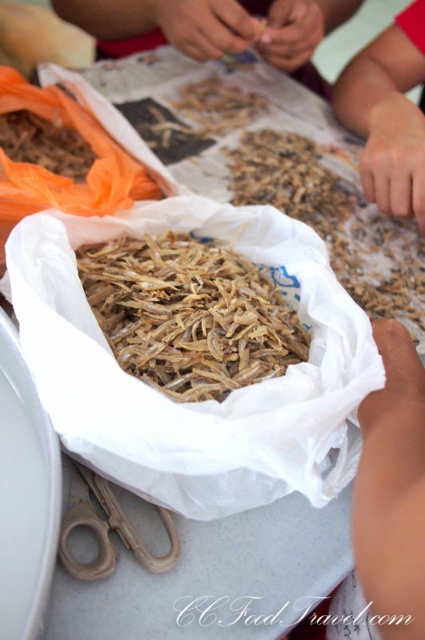
Question: Which is farther from the skinny arm at upper center?

Choices:
 (A) brown matte dried shrimp at center
 (B) brown crispy snack at center

Answer: (B)

Question: Can you confirm if brown matte dried shrimp at center is thinner than brown paper bag at upper center?

Choices:
 (A) no
 (B) yes

Answer: (B)

Question: Can you confirm if brown crispy snack at center is wider than brown wooden scissors at lower left?

Choices:
 (A) no
 (B) yes

Answer: (B)

Question: Which object is the closest to the brown wooden scissors at lower left?

Choices:
 (A) brown crispy snack at center
 (B) brown matte dried shrimp at center
 (C) skinny arm at upper center
 (D) brown paper bag at upper center

Answer: (A)

Question: From the image, what is the correct spatial relationship of brown matte dried shrimp at center in relation to brown paper bag at upper center?

Choices:
 (A) below
 (B) above

Answer: (A)

Question: Which point is farther to the camera?

Choices:
 (A) brown crispy snack at center
 (B) skinny arm at upper center
 (C) brown paper bag at upper center

Answer: (C)